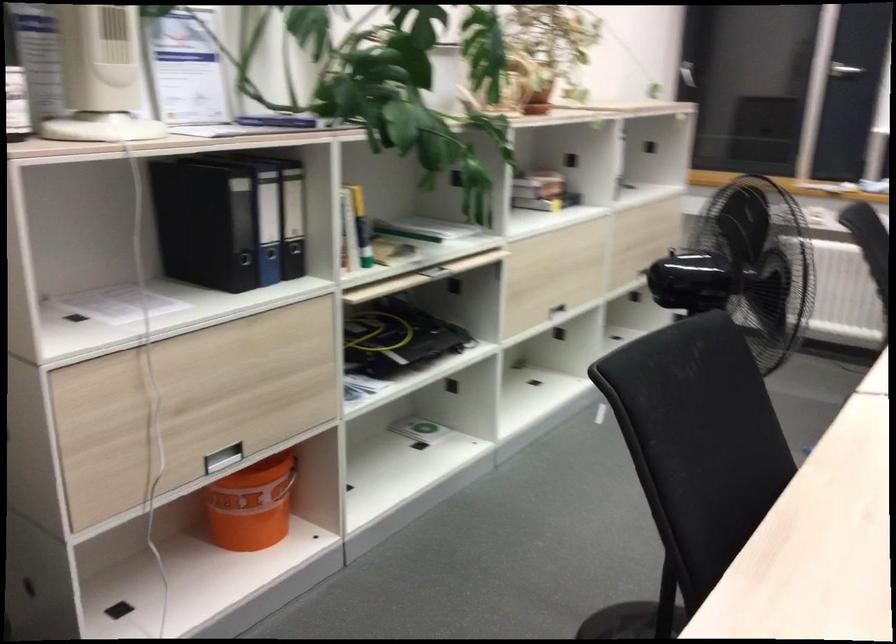
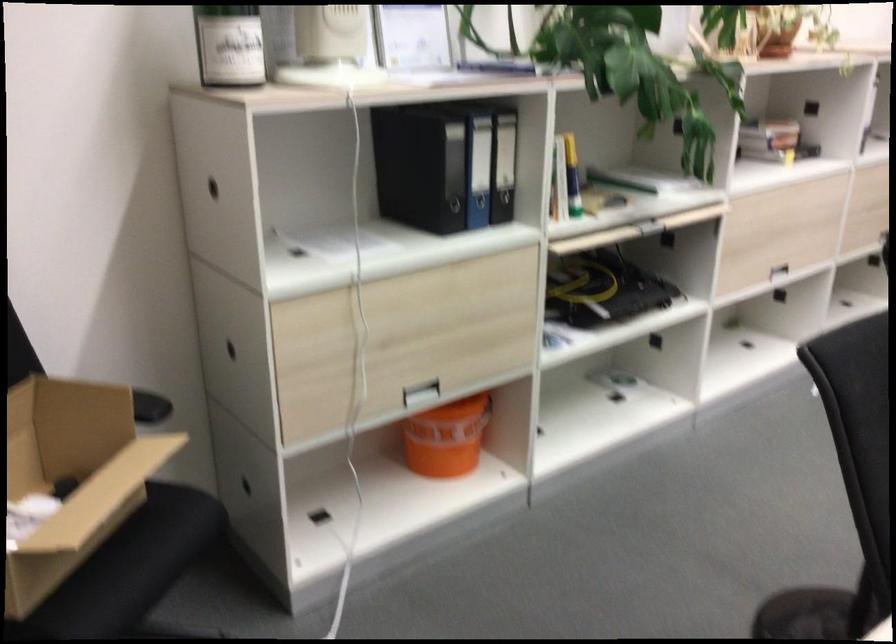
The point at (268,223) is marked in the first image. Where is the corresponding point in the second image?

(478, 169)